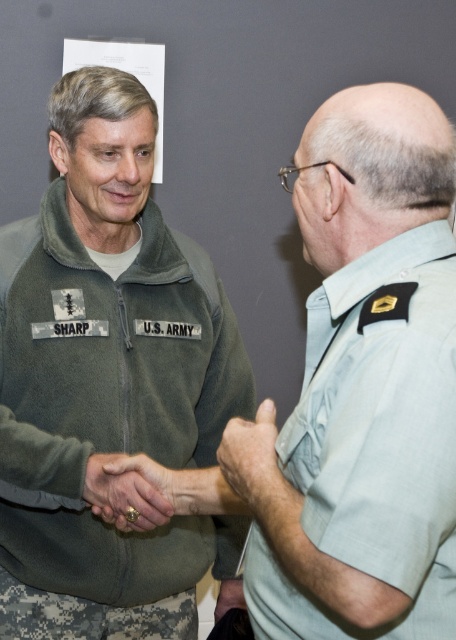
Is point (93, 339) positioned in front of point (331, 285)?

No, it is not.

Does green fleece jacket at center appear under light blue fabric at upper right?

No, green fleece jacket at center is not below light blue fabric at upper right.

Who is more forward, (5, 268) or (364, 552)?

Point (364, 552) is in front.

In order to click on green fleece jacket at center in this screenshot , I will do (110, 403).

Can you confirm if gold ring at center is shorter than matte gray hand at lower center?

Yes, gold ring at center is shorter than matte gray hand at lower center.

Does gold ring at center have a larger size compared to matte gray hand at lower center?

No, gold ring at center is not bigger than matte gray hand at lower center.

Which is in front, point (119, 497) or point (242, 588)?

Point (119, 497) is in front.

This screenshot has width=456, height=640. Identify the location of gold ring at center. (124, 496).

Who is positioned more to the left, smooth skin hand at center or matte gray hand at lower center?

matte gray hand at lower center

Is point (273, 493) closer to camera compared to point (243, 602)?

Yes.

What are the coordinates of `smooth skin hand at center` in the screenshot? It's located at (253, 464).